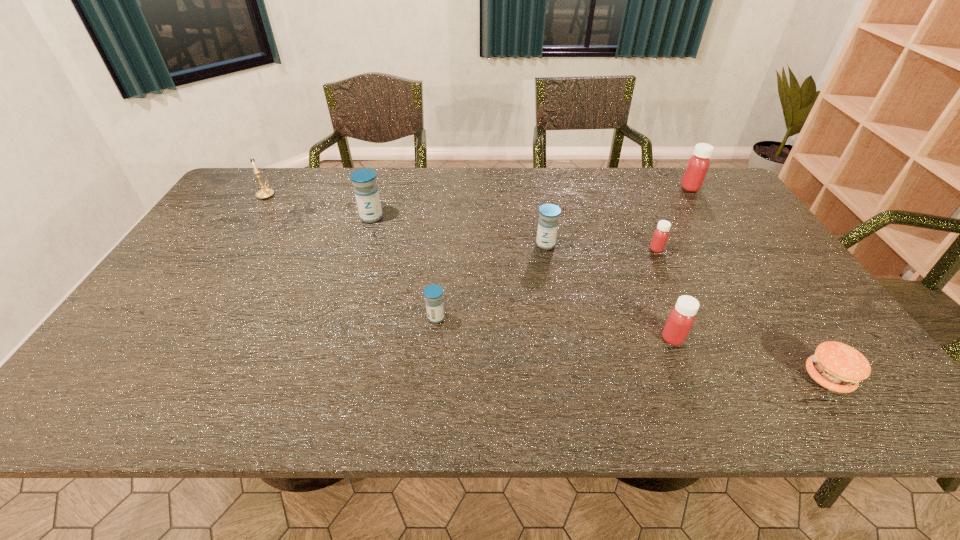
The width and height of the screenshot is (960, 540). Find the location of `free space between the fourth medicine from left to right and the second smallest blue medicine`. free space between the fourth medicine from left to right and the second smallest blue medicine is located at coordinates (610, 292).

Identify the location of free space between the shortest object and the leftmost object. (547, 286).

Where is `free point between the rightmost red medicine and the candle holder`? The height and width of the screenshot is (540, 960). free point between the rightmost red medicine and the candle holder is located at coordinates (478, 191).

Locate an element on the screen. The height and width of the screenshot is (540, 960). free spot between the smallest red medicine and the leftmost blue medicine is located at coordinates (514, 233).

At what (x,y) coordinates should I click in order to perform the action: click on empty space that is in between the smallest red medicine and the patty. Please return your answer as a coordinate pair (x, y). Looking at the image, I should click on (742, 313).

You are a GUI agent. You are given a task and a screenshot of the screen. Output one action in this format:
    pyautogui.click(x=<x>, y=<y>)
    Task: Click on the free space between the candle holder and the fourth medicine from right to left
    
    Given the screenshot: What is the action you would take?
    pyautogui.click(x=406, y=220)

Find the location of a particular element. The height and width of the screenshot is (540, 960). empty space that is in between the sixth farthest object and the third medicine from left to right is located at coordinates (491, 281).

I want to click on vacant area between the nearest object and the second smallest red medicine, so click(x=751, y=358).

At what (x,y) coordinates should I click in order to perform the action: click on empty space between the second farthest red medicine and the rightmost medicine. Please return your answer as a coordinate pair (x, y). This screenshot has height=540, width=960. Looking at the image, I should click on (673, 218).

Locate an element on the screen. This screenshot has width=960, height=540. free space between the fifth nearest medicine and the second blue medicine from left to right is located at coordinates (404, 267).